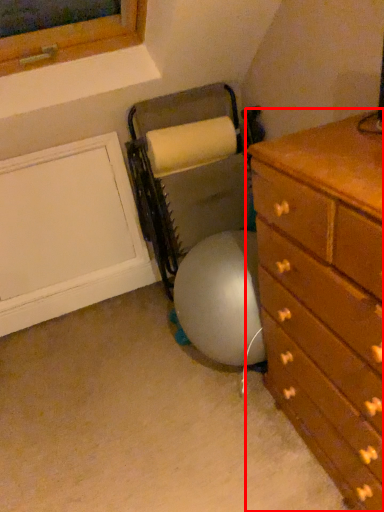
Question: Considering the relative positions of chest of drawers (annotated by the red box) and bean bag chair in the image provided, where is chest of drawers (annotated by the red box) located with respect to the staircase?

Choices:
 (A) left
 (B) right

Answer: (B)